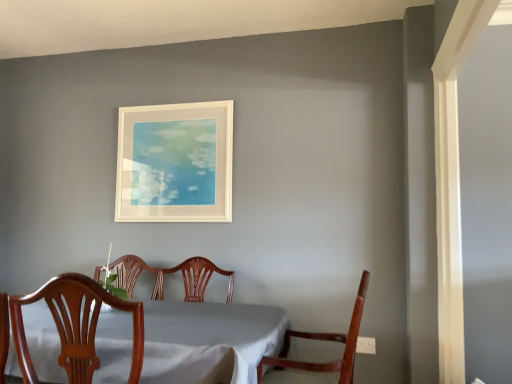
Question: Would you say white matte picture frame at upper center is part of mahogany wood chair at lower right, the 2th chair viewed from the left,'s contents?

Choices:
 (A) no
 (B) yes

Answer: (A)

Question: Considering the relative sizes of mahogany wood chair at lower right, which is the first chair in right-to-left order, and white matte picture frame at upper center in the image provided, is mahogany wood chair at lower right, which is the first chair in right-to-left order, thinner than white matte picture frame at upper center?

Choices:
 (A) no
 (B) yes

Answer: (A)

Question: Does mahogany wood chair at lower right, which is the first chair in right-to-left order, lie in front of white matte picture frame at upper center?

Choices:
 (A) yes
 (B) no

Answer: (A)

Question: Are mahogany wood chair at lower right, the 2th chair viewed from the left, and white matte picture frame at upper center far apart?

Choices:
 (A) no
 (B) yes

Answer: (B)

Question: Is mahogany wood chair at lower right, the 2th chair viewed from the left, to the left of white matte picture frame at upper center from the viewer's perspective?

Choices:
 (A) no
 (B) yes

Answer: (A)

Question: Is white matte picture frame at upper center inside or outside of mahogany wood chair at lower right, which is the first chair in right-to-left order?

Choices:
 (A) outside
 (B) inside

Answer: (A)

Question: Is white matte picture frame at upper center wider or thinner than mahogany wood chair at lower right, which is the first chair in right-to-left order?

Choices:
 (A) thin
 (B) wide

Answer: (A)

Question: Considering their positions, is white matte picture frame at upper center located in front of or behind mahogany wood chair at lower right, which is the first chair in right-to-left order?

Choices:
 (A) behind
 (B) front

Answer: (A)

Question: From the image's perspective, is white matte picture frame at upper center located above or below mahogany wood chair at lower right, which is the first chair in right-to-left order?

Choices:
 (A) above
 (B) below

Answer: (A)

Question: From a real-world perspective, is wooden chair at center, marked as the second chair in a right-to-left arrangement, physically located above or below white matte picture frame at upper center?

Choices:
 (A) above
 (B) below

Answer: (B)

Question: In terms of height, does wooden chair at center, which appears as the first chair when viewed from the left, look taller or shorter compared to white matte picture frame at upper center?

Choices:
 (A) short
 (B) tall

Answer: (A)

Question: Considering their positions, is wooden chair at center, marked as the second chair in a right-to-left arrangement, located in front of or behind white matte picture frame at upper center?

Choices:
 (A) behind
 (B) front

Answer: (B)

Question: Choose the correct answer: Is wooden chair at center, marked as the second chair in a right-to-left arrangement, inside white matte picture frame at upper center or outside it?

Choices:
 (A) outside
 (B) inside

Answer: (A)

Question: Considering the positions of point (307, 337) and point (72, 352), is point (307, 337) closer or farther from the camera than point (72, 352)?

Choices:
 (A) closer
 (B) farther

Answer: (B)

Question: Visually, is mahogany wood chair at lower right, the 2th chair viewed from the left, positioned to the left or to the right of wooden chair at center, which appears as the first chair when viewed from the left?

Choices:
 (A) left
 (B) right

Answer: (B)